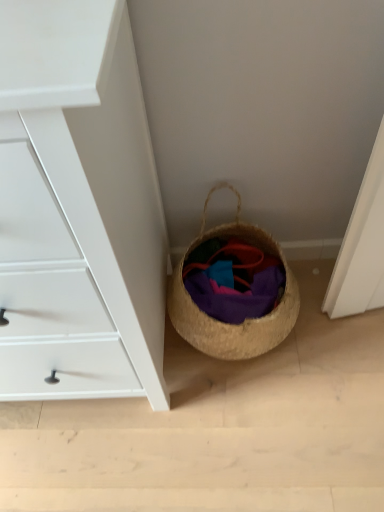
The width and height of the screenshot is (384, 512). I want to click on free space on the front side of woven straw basket at lower right, so click(250, 429).